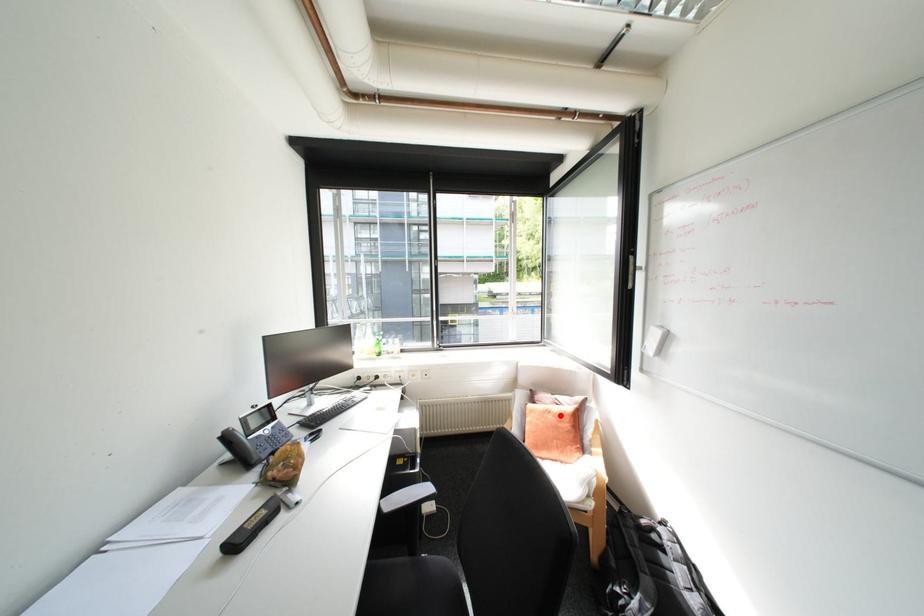
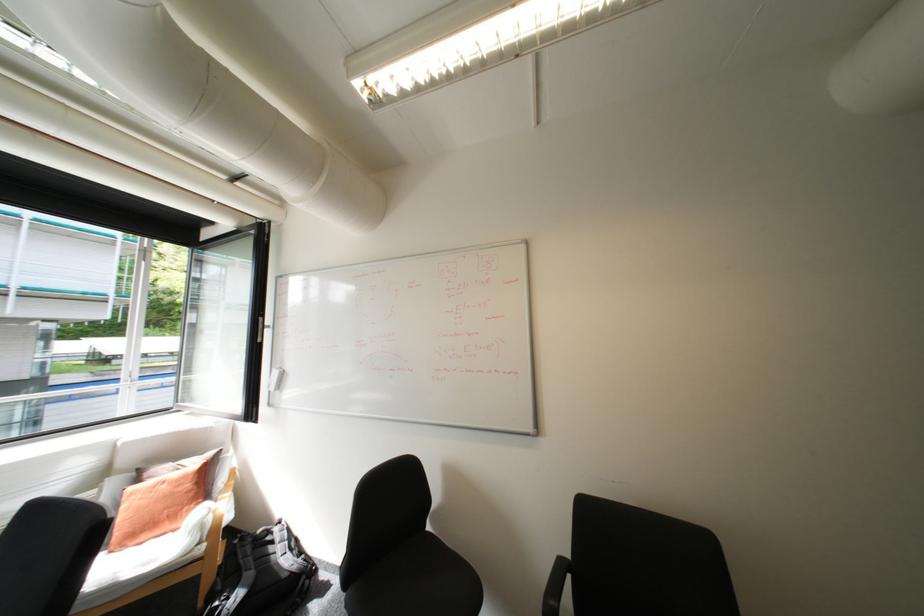
Where in the second image is the point corresponding to the highlighted location from the first image?

(175, 485)